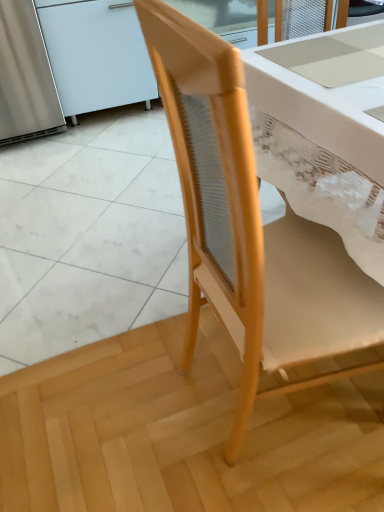
Identify the location of vacant space to the left of natural wood chair at center. The width and height of the screenshot is (384, 512). (133, 394).